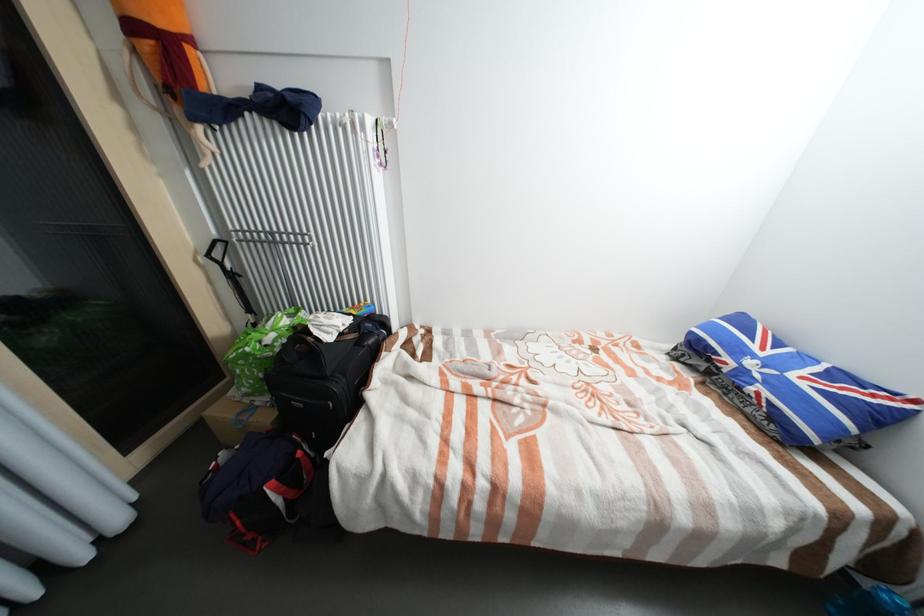
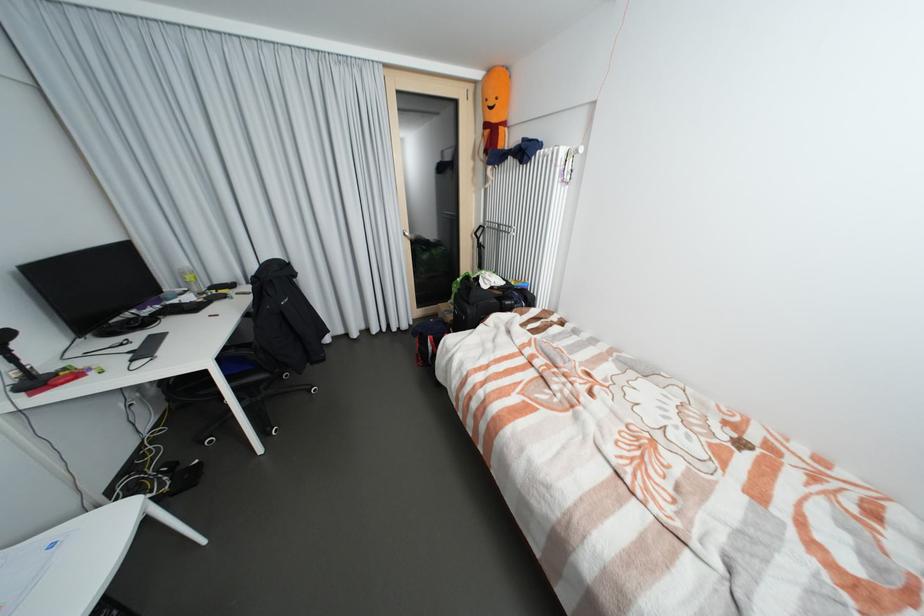
Question: I am providing you with two images of the same scene from different viewpoints. Please identify which objects are invisible in image2.

Choices:
 (A) chair sitting surface
 (B) silver door handle
 (C) orange stuffed toy
 (D) none of these

Answer: (D)